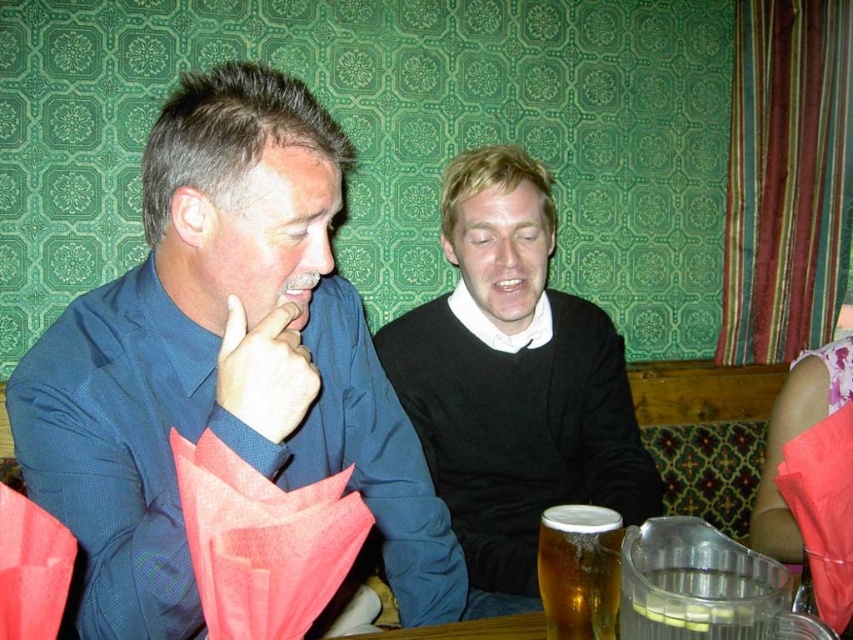
Question: Which point is closer to the camera?

Choices:
 (A) golden amber liquid at lower center
 (B) black matte sweater at center

Answer: (A)

Question: Based on their relative distances, which object is farther from the black matte sweater at center?

Choices:
 (A) matte blue shirt at left
 (B) blue textured shirt at left
 (C) golden amber liquid at lower center

Answer: (A)

Question: Does blue textured shirt at left have a greater width compared to golden amber liquid at lower center?

Choices:
 (A) no
 (B) yes

Answer: (B)

Question: Does black matte sweater at center have a smaller size compared to golden amber liquid at lower center?

Choices:
 (A) no
 (B) yes

Answer: (A)

Question: Which object is positioned closest to the matte blue shirt at left?

Choices:
 (A) black matte sweater at center
 (B) golden amber liquid at lower center
 (C) blue textured shirt at left

Answer: (C)

Question: Does black matte sweater at center come behind matte blue shirt at left?

Choices:
 (A) yes
 (B) no

Answer: (A)